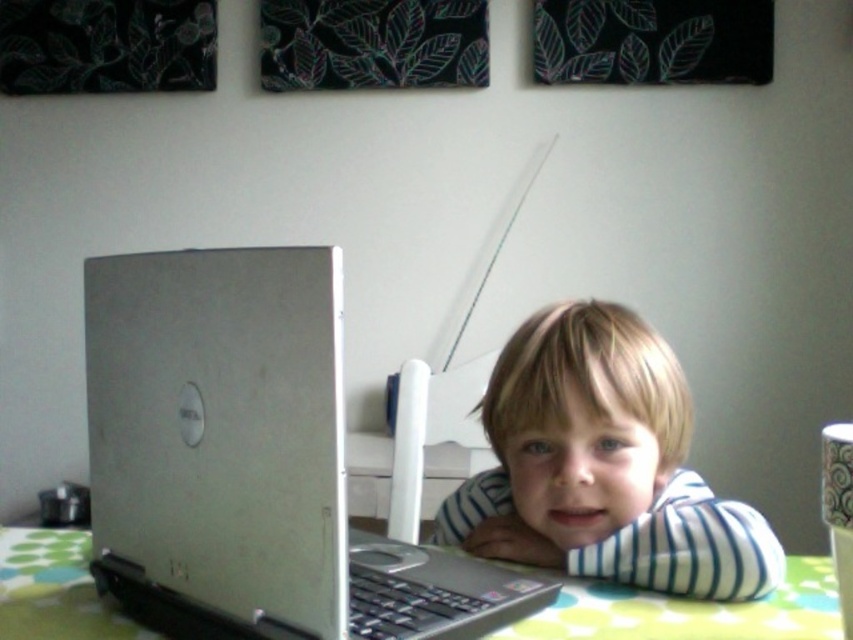
Question: Which point is closer to the camera?

Choices:
 (A) blonde hair at center
 (B) green dotted fabric at lower center

Answer: (B)

Question: Is blonde hair at center thinner than green dotted fabric at lower center?

Choices:
 (A) yes
 (B) no

Answer: (B)

Question: Based on their relative distances, which object is farther from the green dotted fabric at lower center?

Choices:
 (A) silver metallic laptop at center
 (B) blonde hair at center

Answer: (B)

Question: Which point is farther to the camera?

Choices:
 (A) silver metallic laptop at center
 (B) green dotted fabric at lower center

Answer: (B)

Question: Does blonde hair at center come in front of green dotted fabric at lower center?

Choices:
 (A) yes
 (B) no

Answer: (B)

Question: Does silver metallic laptop at center lie behind blonde hair at center?

Choices:
 (A) yes
 (B) no

Answer: (B)